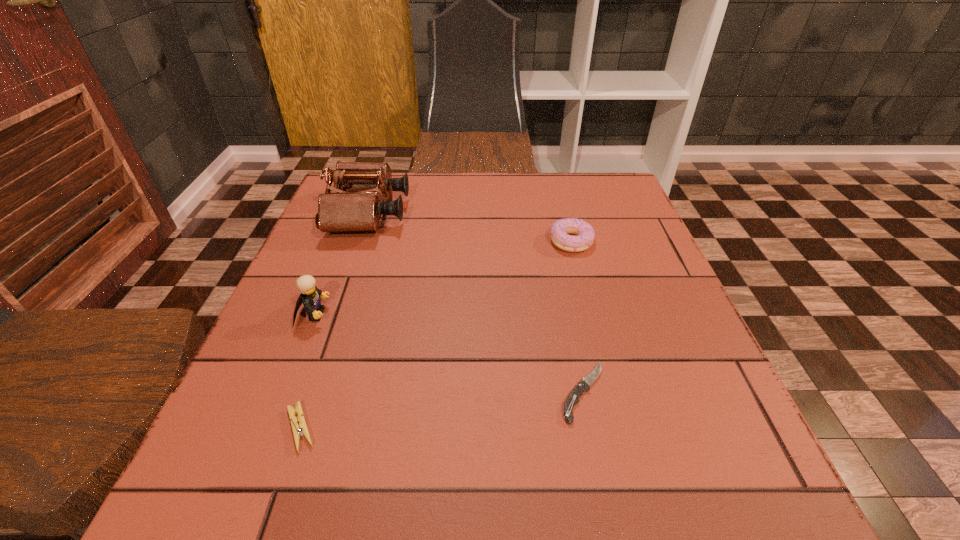
Identify the location of vacant point located between the tallest object and the second tallest object. (341, 264).

At what (x,y) coordinates should I click in order to perform the action: click on unoccupied area between the pocketknife and the third tallest object. Please return your answer as a coordinate pair (x, y). Looking at the image, I should click on (577, 317).

The image size is (960, 540). In order to click on vacant area that lies between the tallest object and the clothespin in this screenshot , I will do `click(334, 321)`.

In order to click on object identified as the second closest to the tallest object in this screenshot , I will do coord(585,234).

Identify which object is located as the fourth nearest to the Lego. Please provide its 2D coordinates. Your answer should be formatted as a tuple, i.e. [(x, y)], where the tuple contains the x and y coordinates of a point satisfying the conditions above.

[(585, 234)]

Where is `vacant space that satisfies the following two spatial constraints: 1. on the back side of the pocketknife; 2. on the left side of the clothespin`? The image size is (960, 540). vacant space that satisfies the following two spatial constraints: 1. on the back side of the pocketknife; 2. on the left side of the clothespin is located at coordinates (313, 392).

Identify the location of free space that satisfies the following two spatial constraints: 1. through the eyepieces of the third tallest object; 2. on the left side of the tallest object. The height and width of the screenshot is (540, 960). (359, 241).

I want to click on vacant space that satisfies the following two spatial constraints: 1. through the eyepieces of the clothespin; 2. on the right side of the binoculars, so click(294, 428).

Where is `vacant region that satisfies the following two spatial constraints: 1. on the front-facing side of the pocketknife; 2. on the left side of the second tallest object`? This screenshot has height=540, width=960. vacant region that satisfies the following two spatial constraints: 1. on the front-facing side of the pocketknife; 2. on the left side of the second tallest object is located at coordinates (283, 392).

Locate an element on the screen. vacant point that satisfies the following two spatial constraints: 1. on the back side of the third shortest object; 2. through the eyepieces of the binoculars is located at coordinates (564, 214).